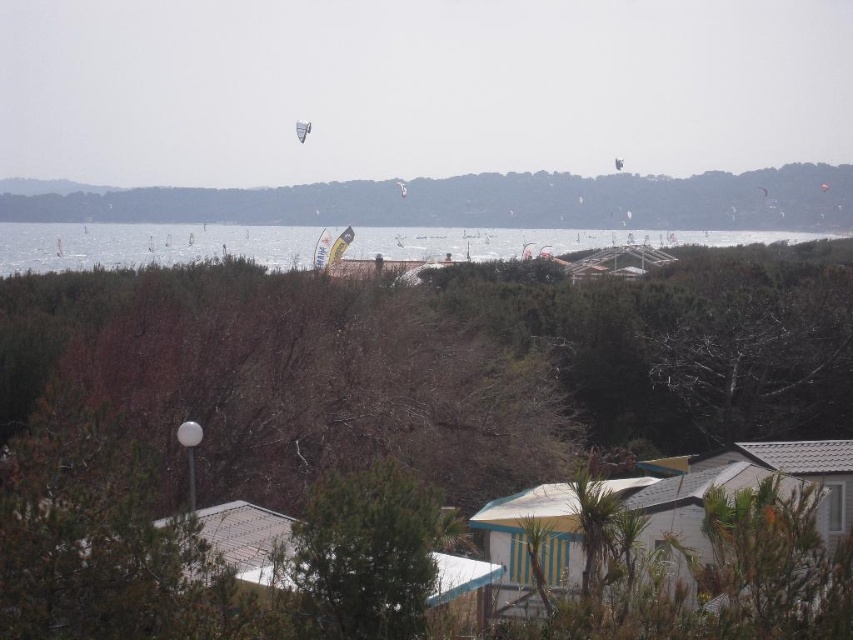
Is transparent kite at upper center thinner than brown/drytree at center?

Incorrect, transparent kite at upper center's width is not less than brown/drytree at center's.

Does transparent kite at upper center have a larger size compared to brown/drytree at center?

Indeed, transparent kite at upper center has a larger size compared to brown/drytree at center.

Looking at this image, who is more distant from viewer, (482,22) or (161,484)?

The point (482,22) is more distant.

Identify the location of transparent kite at upper center. (416, 88).

Is brown/drytree at center above green leafy tree at center?

Yes.

Is point (331, 340) behind point (363, 579)?

Yes.

Between point (6, 358) and point (361, 636), which one is positioned in front?

Point (361, 636)

This screenshot has height=640, width=853. I want to click on brown/drytree at center, so click(280, 380).

Between green leafy tree at center and white plastic kite at upper center, which one has less height?

green leafy tree at center is shorter.

Is green leafy tree at center closer to camera compared to white plastic kite at upper center?

Yes, it is in front of white plastic kite at upper center.

Which is behind, point (317, 570) or point (303, 131)?

The point (303, 131) is behind.

You are a GUI agent. You are given a task and a screenshot of the screen. Output one action in this format:
    pyautogui.click(x=<x>, y=<y>)
    Task: Click on the green leafy tree at center
    
    Given the screenshot: What is the action you would take?
    pyautogui.click(x=364, y=556)